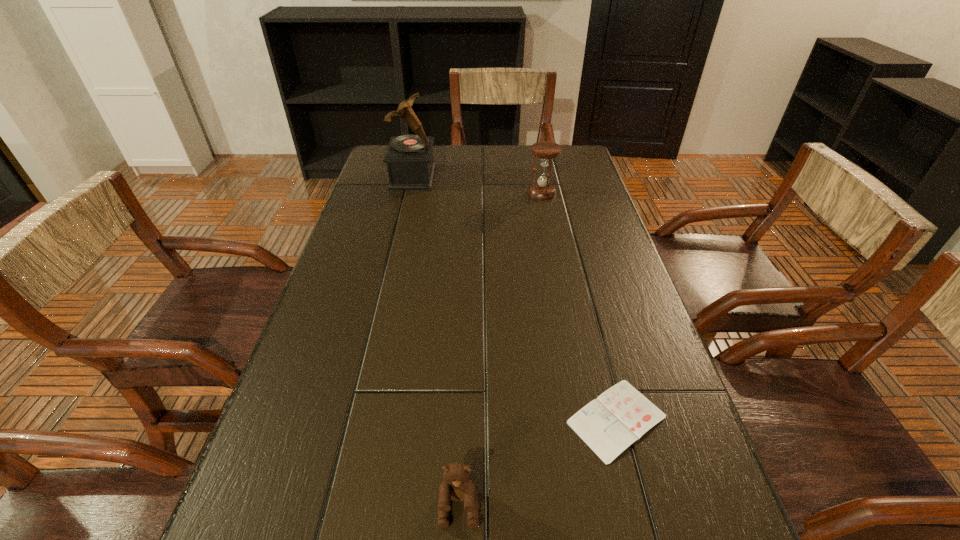
Image resolution: width=960 pixels, height=540 pixels. I want to click on object that is positioned at the far edge, so click(409, 158).

Locate an element on the screen. object that is positioned at the left edge is located at coordinates (x=409, y=158).

The height and width of the screenshot is (540, 960). Find the location of `hourglass at the right edge`. hourglass at the right edge is located at coordinates (545, 151).

Where is `diary that is at the right edge`? The image size is (960, 540). diary that is at the right edge is located at coordinates (621, 415).

The width and height of the screenshot is (960, 540). Find the location of `object that is at the far left corner`. object that is at the far left corner is located at coordinates (409, 158).

In the image, there is a desktop. Where is `free space at the far edge`? The image size is (960, 540). free space at the far edge is located at coordinates (435, 152).

The width and height of the screenshot is (960, 540). What are the coordinates of `vacant space at the left edge of the desktop` in the screenshot? It's located at (295, 431).

You are a GUI agent. You are given a task and a screenshot of the screen. Output one action in this format:
    pyautogui.click(x=<x>, y=<y>)
    Task: Click on the vacant space at the right edge of the desktop
    
    Given the screenshot: What is the action you would take?
    pyautogui.click(x=563, y=202)

Locate an element on the screen. The image size is (960, 540). vacant point located between the third tallest object and the phonograph_record is located at coordinates pos(436,342).

This screenshot has height=540, width=960. In order to click on free space between the nearest object and the leftmost object in this screenshot , I will do `click(436, 342)`.